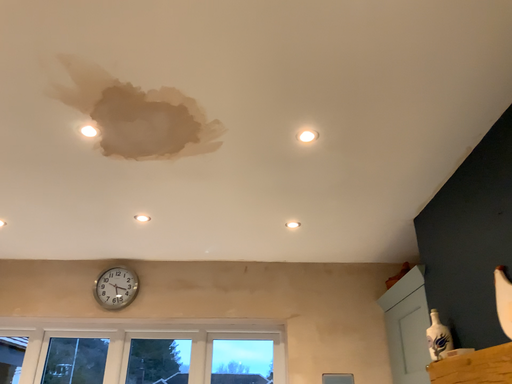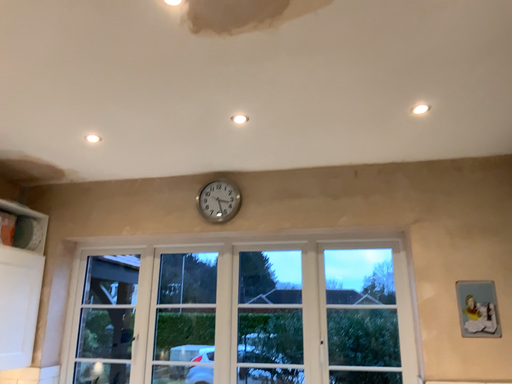
Question: How did the camera likely rotate when shooting the video?

Choices:
 (A) rotated left
 (B) rotated right

Answer: (A)